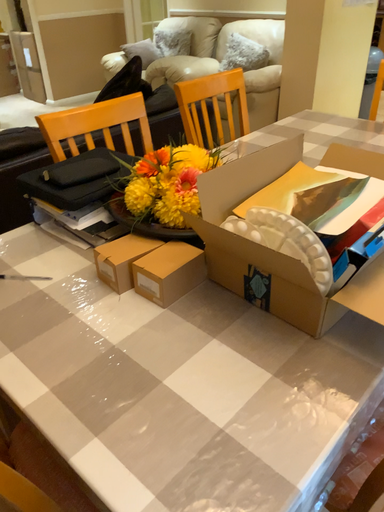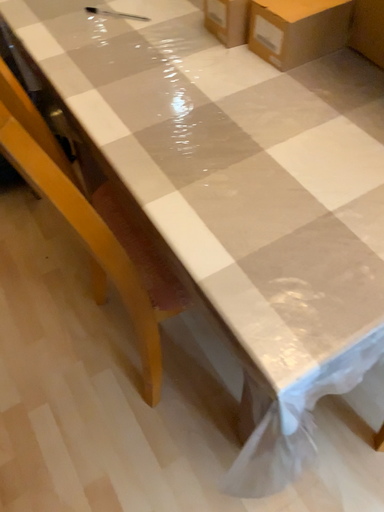
Question: How did the camera likely rotate when shooting the video?

Choices:
 (A) rotated left
 (B) rotated right

Answer: (A)